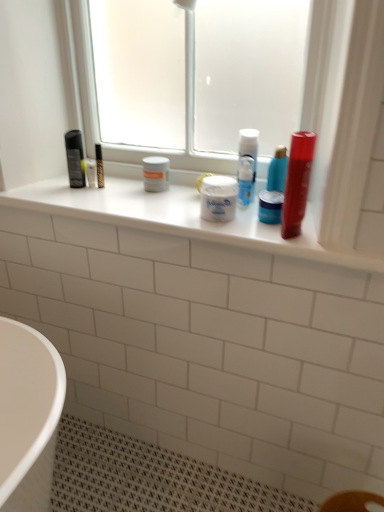
Locate an element on the screen. This screenshot has width=384, height=512. free space in front of blue glossy jar at center, the first mouthwash viewed from the back is located at coordinates (288, 237).